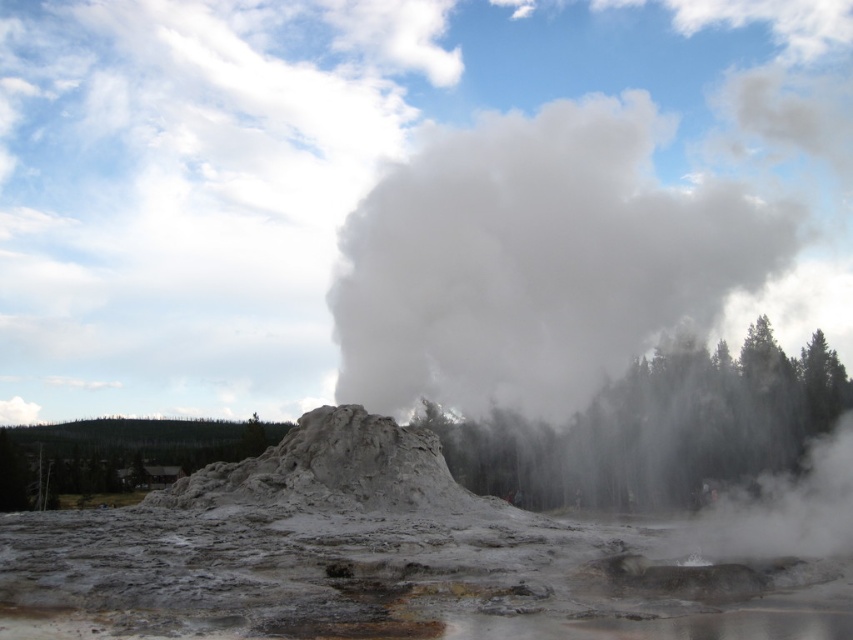
You are a geologist observing the geothermal area. You notice the white vapor at center and the gray mud volcano at center. Which object is located above the other?

The white vapor at center is positioned over the gray mud volcano at center.

You are a geologist standing at the edge of the geyser field. You notice two distinct white plumes, the white steam at center and the white vapor at center. Which one is farther from your current position?

The white vapor at center is farther from your current position because there is a distance of 23.90 meters between the white steam at center and white vapor at center.